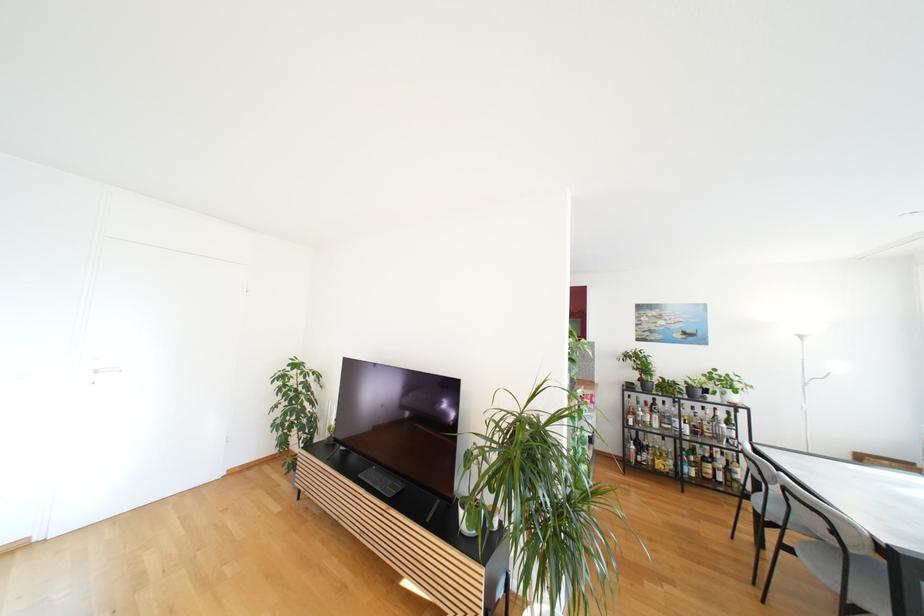
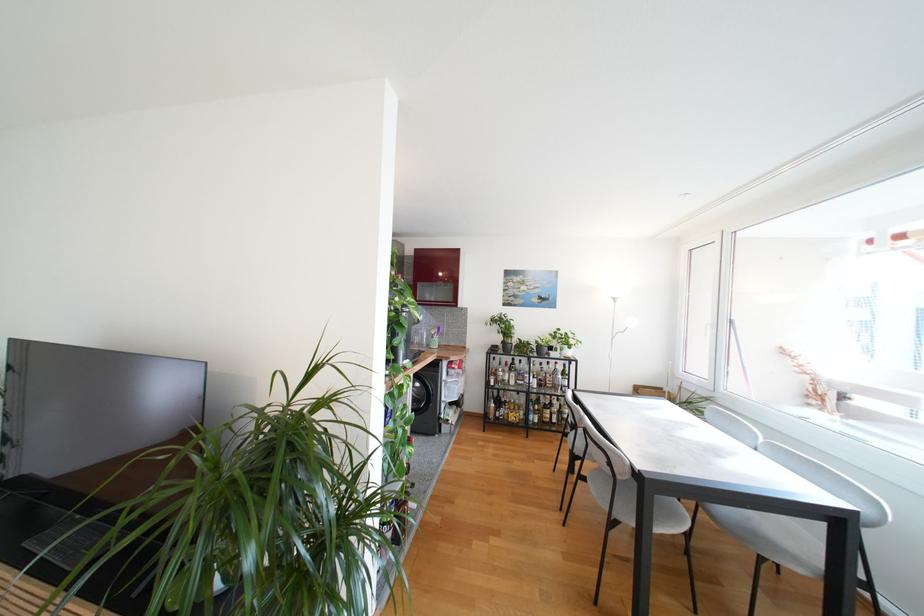
Where in the second image is the point corresponding to pixel 682 424 from the first image?

(532, 379)